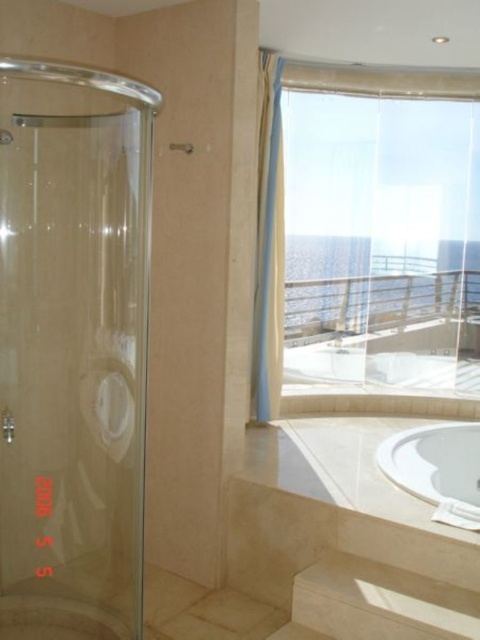
You are standing in the bathroom and want to reach the translucent fabric curtain at upper right. There is a beige fabric curtain at upper center in your way. Which curtain should you move first to get to the one you want?

You should move the beige fabric curtain at upper center first because the translucent fabric curtain at upper right is behind it, closer to you.